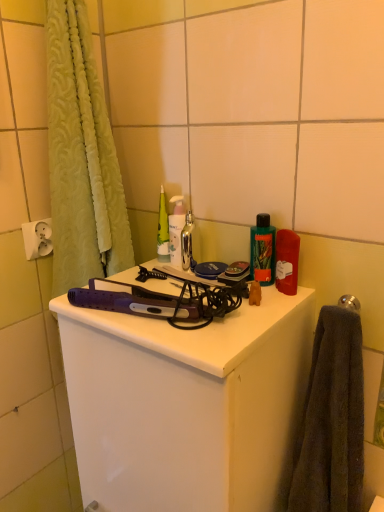
You are a GUI agent. You are given a task and a screenshot of the screen. Output one action in this format:
    pyautogui.click(x=<x>, y=<y>)
    Task: Click on the vacant area on top of purple plastic hair straightener at center (from a real-world perspective)
    The image size is (384, 512).
    Given the screenshot: What is the action you would take?
    pyautogui.click(x=169, y=291)